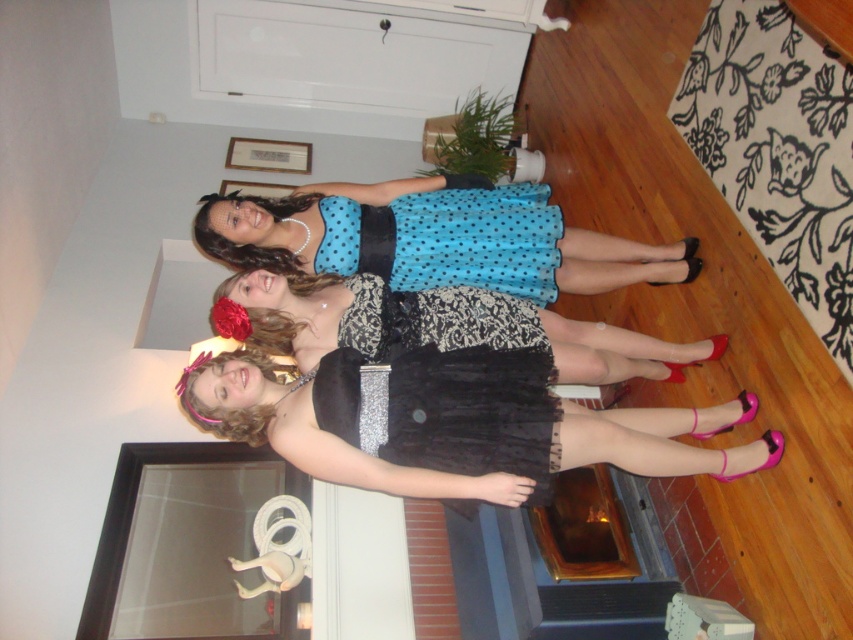
Does black tulle dress at center appear on the left side of black lace dress at center?

Indeed, black tulle dress at center is positioned on the left side of black lace dress at center.

Who is more forward, (639, 467) or (303, 321)?

Positioned in front is point (639, 467).

What do you see at coordinates (460, 426) in the screenshot?
I see `black tulle dress at center` at bounding box center [460, 426].

Locate an element on the screen. This screenshot has height=640, width=853. black tulle dress at center is located at coordinates (460, 426).

Is black lace dress at center wider than blue polka dot tulle dress at center?

Yes, black lace dress at center is wider than blue polka dot tulle dress at center.

Where is `black lace dress at center`? black lace dress at center is located at coordinates (442, 324).

Between black tulle dress at center and blue polka dot dress at center, which one has less height?

Result: black tulle dress at center

What do you see at coordinates (460, 426) in the screenshot?
I see `black tulle dress at center` at bounding box center [460, 426].

This screenshot has height=640, width=853. Identify the location of black tulle dress at center. (460, 426).